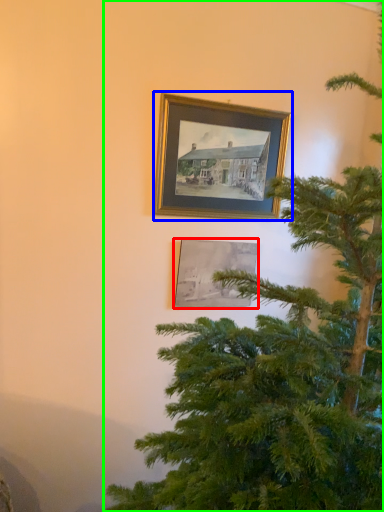
Question: Considering the real-world distances, which object is farthest from picture frame (highlighted by a red box)? picture frame (highlighted by a blue box) or christmas tree (highlighted by a green box)?

Choices:
 (A) picture frame
 (B) christmas tree

Answer: (B)